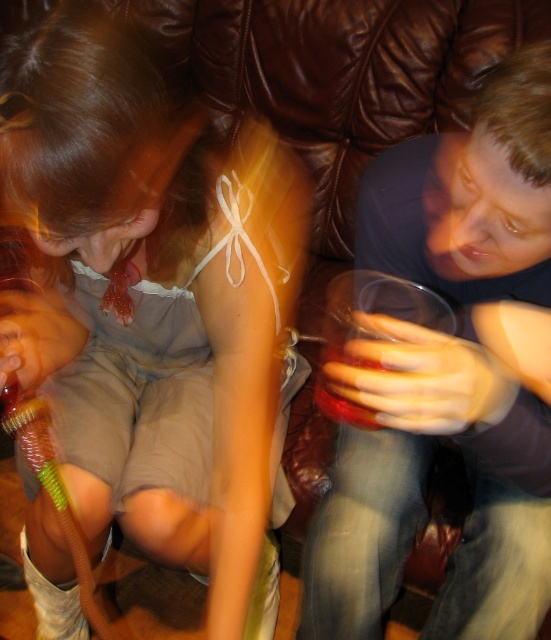
You are a photographer adjusting your camera settings to focus on the matte white ribbon at upper center and the matte plastic cup at right. Which object should you focus on first to ensure both are in sharp focus?

The matte white ribbon at upper center is closer to the viewer than the matte plastic cup at right, so focus on the matte white ribbon at upper center first to ensure both are in sharp focus.

You are a guest at a party and want to tie a gift with the matte white ribbon at upper center. However, you only have a matte plastic cup at right as a reference. Can you estimate if the ribbon is big enough to wrap around the cup?

The matte white ribbon at upper center is larger in size than the matte plastic cup at right, so the ribbon should be big enough to wrap around the cup.